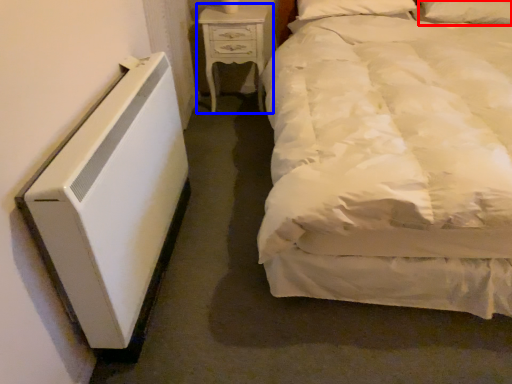
Question: Which object appears closest to the camera in this image, pillow (highlighted by a red box) or nightstand (highlighted by a blue box)?

Choices:
 (A) pillow
 (B) nightstand

Answer: (A)